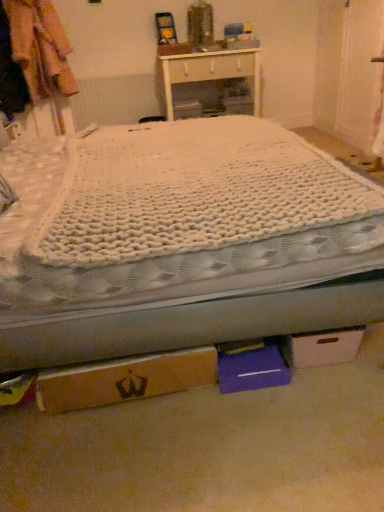
Question: Is point (178, 388) closer or farther from the camera than point (11, 173)?

Choices:
 (A) closer
 (B) farther

Answer: (A)

Question: In terms of size, does brown cardboard box at lower center, the second cardboard box positioned from the right, appear bigger or smaller than white knitted blanket at center?

Choices:
 (A) big
 (B) small

Answer: (B)

Question: Based on their relative distances, which object is farther from the white knitted mattress at center?

Choices:
 (A) white glossy cabinet at upper center
 (B) white knitted blanket at center
 (C) purple cardboard box at lower center, acting as the 1th storage box starting from the bottom
 (D) white cardboard box at center, the second storage box positioned from the right
 (E) cardboard box at lower right, which ranks as the first cardboard box in right-to-left order

Answer: (D)

Question: Which of these objects is positioned closest to the white knitted mattress at center?

Choices:
 (A) light brown fabric coat at left
 (B) brown cardboard box at lower center, the second cardboard box positioned from the right
 (C) purple cardboard box at lower center, positioned as the first storage box in right-to-left order
 (D) white cardboard box at center, which appears as the first storage box when viewed from the left
 (E) white glossy cabinet at upper center

Answer: (B)